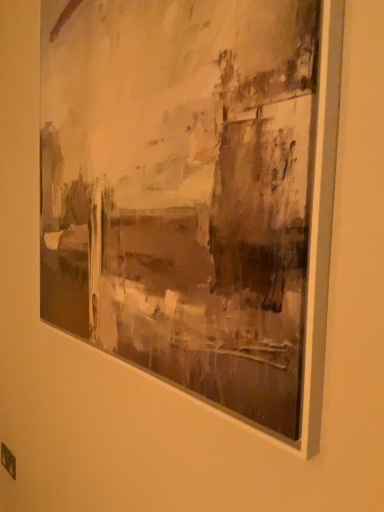
Measure the distance between point (135,57) and camera.

Point (135,57) and camera are 33.98 inches apart from each other.

Identify the location of wooden picture frame at upper center. The height and width of the screenshot is (512, 384). (195, 194).

Image resolution: width=384 pixels, height=512 pixels. What do you see at coordinates (195, 194) in the screenshot?
I see `wooden picture frame at upper center` at bounding box center [195, 194].

Locate an element on the screen. wooden picture frame at upper center is located at coordinates (195, 194).